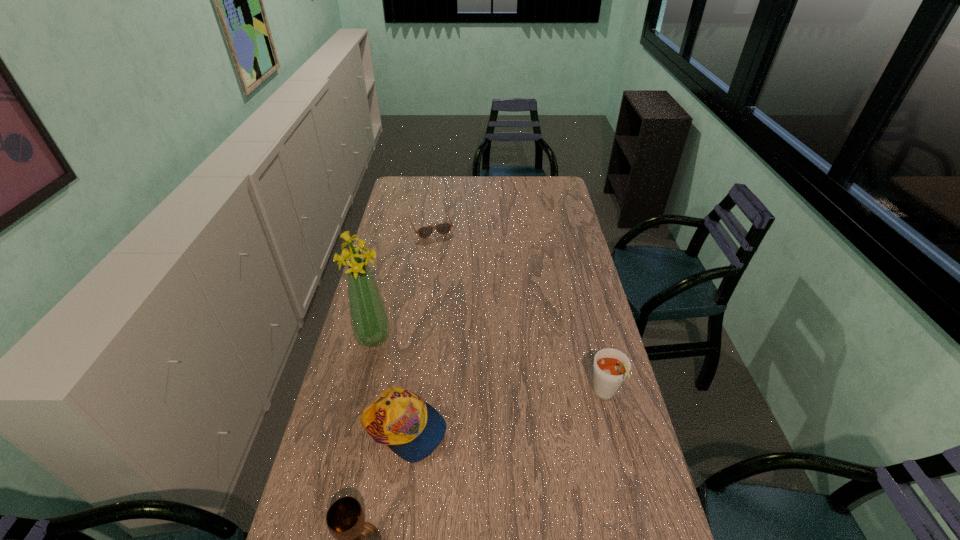
Where is `free space located 0.260m on the front-facing side of the bouquet`? The image size is (960, 540). free space located 0.260m on the front-facing side of the bouquet is located at coordinates (441, 387).

Find the location of `blank space located on the front-facing side of the bouquet`. blank space located on the front-facing side of the bouquet is located at coordinates (412, 366).

You are a GUI agent. You are given a task and a screenshot of the screen. Output one action in this format:
    pyautogui.click(x=<x>, y=<y>)
    Task: Click on the vacant region located 0.050m on the front-facing side of the bouquet
    
    Given the screenshot: What is the action you would take?
    pyautogui.click(x=396, y=353)

Where is `vacant area situated on the front-facing side of the shortest object`? This screenshot has width=960, height=540. vacant area situated on the front-facing side of the shortest object is located at coordinates (449, 267).

Where is `free region located 0.090m on the front-facing side of the shortest object`? This screenshot has width=960, height=540. free region located 0.090m on the front-facing side of the shortest object is located at coordinates (442, 251).

Image resolution: width=960 pixels, height=540 pixels. I want to click on vacant space situated 0.280m on the front-facing side of the shortest object, so click(x=454, y=278).

Locate an element on the screen. The width and height of the screenshot is (960, 540). cap positioned at the left edge is located at coordinates (409, 426).

Image resolution: width=960 pixels, height=540 pixels. I want to click on bouquet at the left edge, so point(369,318).

Find the location of a particular element. This screenshot has width=960, height=540. sunglasses positioned at the left edge is located at coordinates (443, 228).

Where is `object that is at the right edge`? object that is at the right edge is located at coordinates point(611,366).